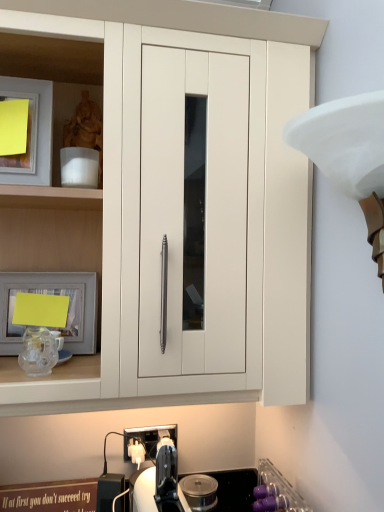
Question: Can you confirm if white plastic electric outlet at lower center is wider than matte silver picture frame at left?

Choices:
 (A) yes
 (B) no

Answer: (B)

Question: Is white plastic electric outlet at lower center closer to the viewer compared to matte silver picture frame at left?

Choices:
 (A) no
 (B) yes

Answer: (A)

Question: Is white plastic electric outlet at lower center bigger than matte silver picture frame at left?

Choices:
 (A) no
 (B) yes

Answer: (A)

Question: Is matte silver picture frame at left a part of white plastic electric outlet at lower center?

Choices:
 (A) no
 (B) yes

Answer: (A)

Question: Considering the relative positions of white plastic electric outlet at lower center and matte silver picture frame at left in the image provided, is white plastic electric outlet at lower center to the left of matte silver picture frame at left from the viewer's perspective?

Choices:
 (A) yes
 (B) no

Answer: (B)

Question: Considering the relative positions of white plastic electric outlet at lower center and matte silver picture frame at left in the image provided, is white plastic electric outlet at lower center behind matte silver picture frame at left?

Choices:
 (A) yes
 (B) no

Answer: (A)

Question: Is matte white cabinet at center bigger than purple plastic cups at lower right?

Choices:
 (A) no
 (B) yes

Answer: (B)

Question: Is matte white cabinet at center smaller than purple plastic cups at lower right?

Choices:
 (A) yes
 (B) no

Answer: (B)

Question: Is matte white cabinet at center oriented away from purple plastic cups at lower right?

Choices:
 (A) no
 (B) yes

Answer: (A)

Question: Would you say matte white cabinet at center contains purple plastic cups at lower right?

Choices:
 (A) yes
 (B) no

Answer: (B)

Question: Are matte white cabinet at center and purple plastic cups at lower right making contact?

Choices:
 (A) no
 (B) yes

Answer: (A)

Question: Does matte white cabinet at center lie behind purple plastic cups at lower right?

Choices:
 (A) yes
 (B) no

Answer: (B)

Question: Considering the relative sizes of white matte lampshade at upper right and matte silver picture frame at left in the image provided, is white matte lampshade at upper right wider than matte silver picture frame at left?

Choices:
 (A) yes
 (B) no

Answer: (A)